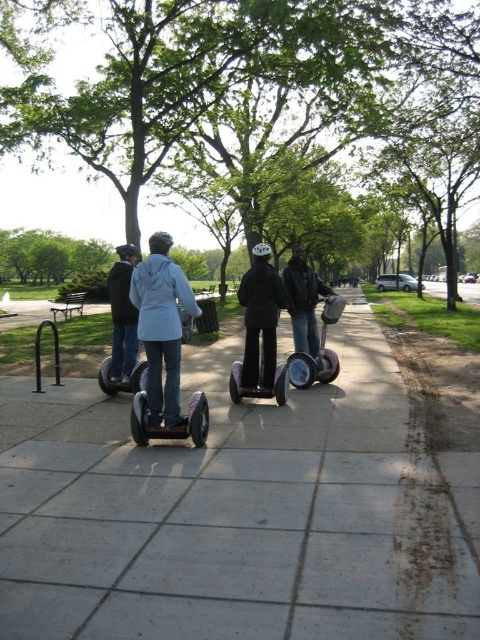
Where is `light blue fabric jacket at center`? light blue fabric jacket at center is located at coordinates (162, 326).

Does light blue fabric jacket at center have a smaller size compared to metallic silver scooter at center?

Indeed, light blue fabric jacket at center has a smaller size compared to metallic silver scooter at center.

Which is behind, point (152, 417) or point (307, 364)?

Positioned behind is point (307, 364).

At what (x,y) coordinates should I click in order to perform the action: click on light blue fabric jacket at center. Please return your answer as a coordinate pair (x, y). This screenshot has height=640, width=480. Looking at the image, I should click on (162, 326).

Measure the distance between gray concrete sidewalk at center and camera.

They are 2.52 meters apart.

Does gray concrete sidewalk at center appear over black matte helmet at center?

No, gray concrete sidewalk at center is not above black matte helmet at center.

Describe the element at coordinates (233, 513) in the screenshot. I see `gray concrete sidewalk at center` at that location.

You are a GUI agent. You are given a task and a screenshot of the screen. Output one action in this format:
    pyautogui.click(x=<x>, y=<y>)
    Task: Click on the gray concrete sidewalk at center
    This screenshot has height=640, width=480.
    Given the screenshot: What is the action you would take?
    pyautogui.click(x=233, y=513)

Can you confirm if black matte helmet at center is smaller than shiny black scooter at center?

Incorrect, black matte helmet at center is not smaller in size than shiny black scooter at center.

Is black matte helmet at center taller than shiny black scooter at center?

Correct, black matte helmet at center is much taller as shiny black scooter at center.

Is point (253, 380) closer to camera compared to point (278, 364)?

Yes, point (253, 380) is closer to viewer.

Find the location of a particular element. The width and height of the screenshot is (480, 640). black matte helmet at center is located at coordinates (261, 317).